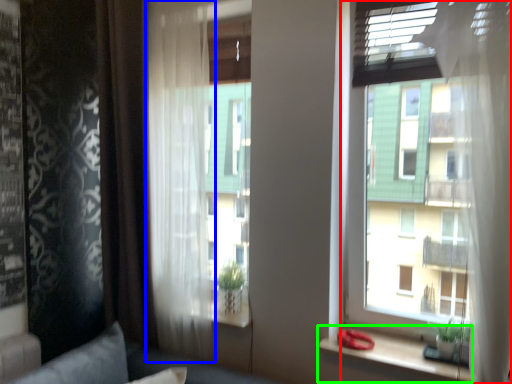
Question: Which object is the farthest from window (highlighted by a red box)? Choose among these: curtain (highlighted by a blue box) or window sill (highlighted by a green box).

Choices:
 (A) curtain
 (B) window sill

Answer: (A)